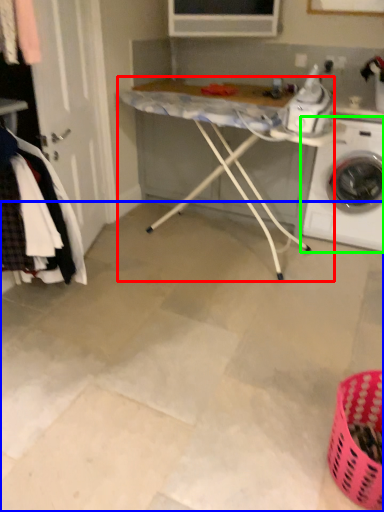
Question: Based on their relative distances, which object is nearer to table (highlighted by a red box)? Choose from concrete (highlighted by a blue box) and washing machine (highlighted by a green box).

Choices:
 (A) concrete
 (B) washing machine

Answer: (B)